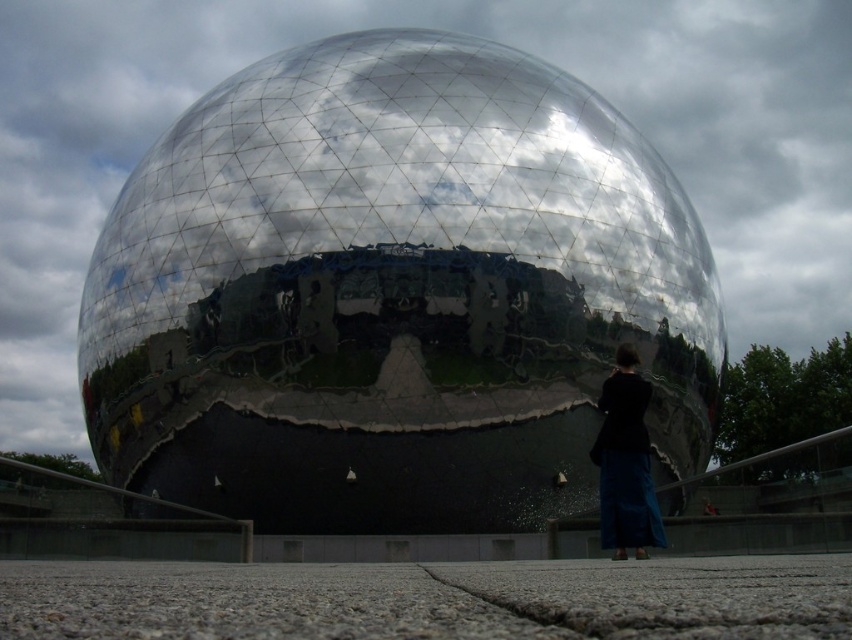
Question: Which point is farther to the camera?

Choices:
 (A) metallic sphere at center
 (B) dark blue fabric at lower right

Answer: (A)

Question: Is metallic sphere at center wider than dark blue fabric at lower right?

Choices:
 (A) no
 (B) yes

Answer: (B)

Question: Which object appears farthest from the camera in this image?

Choices:
 (A) metallic sphere at center
 (B) dark blue fabric at lower right

Answer: (A)

Question: Which of the following is the closest to the observer?

Choices:
 (A) (642, 513)
 (B) (174, 368)

Answer: (A)

Question: Can you confirm if metallic sphere at center is positioned to the right of dark blue fabric at lower right?

Choices:
 (A) yes
 (B) no

Answer: (B)

Question: Is metallic sphere at center further to the viewer compared to dark blue fabric at lower right?

Choices:
 (A) no
 (B) yes

Answer: (B)